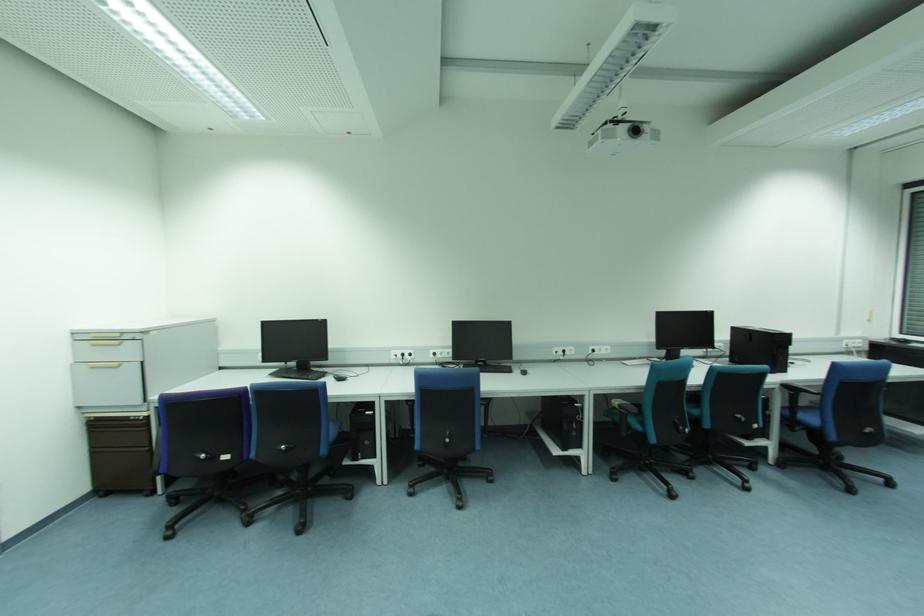
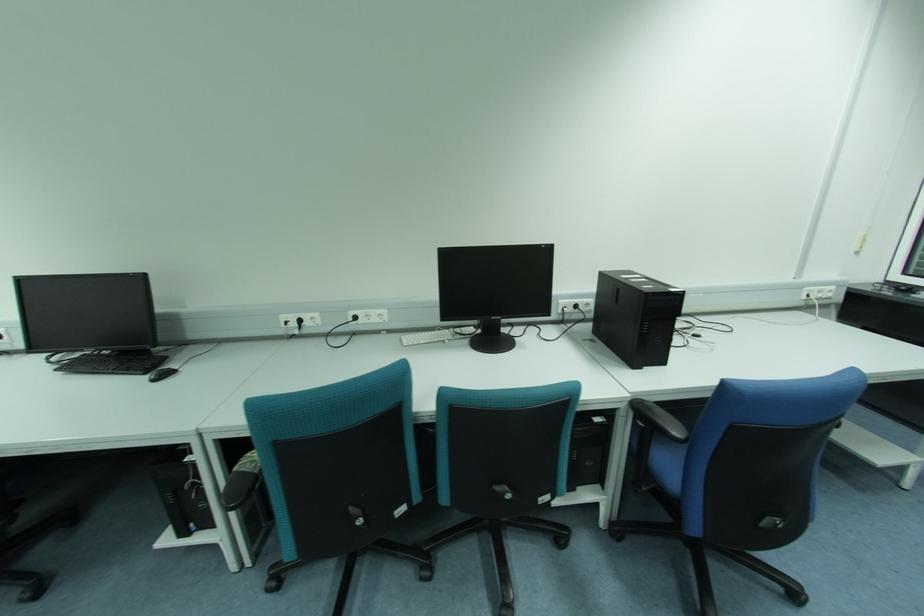
Where in the second image is the point corresponding to point 861,342 from the first image?

(833, 288)